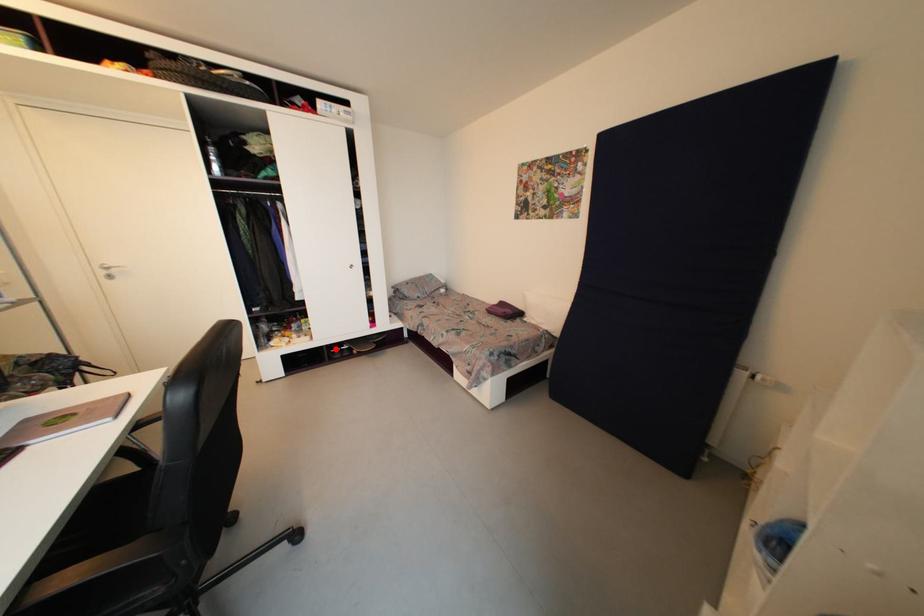
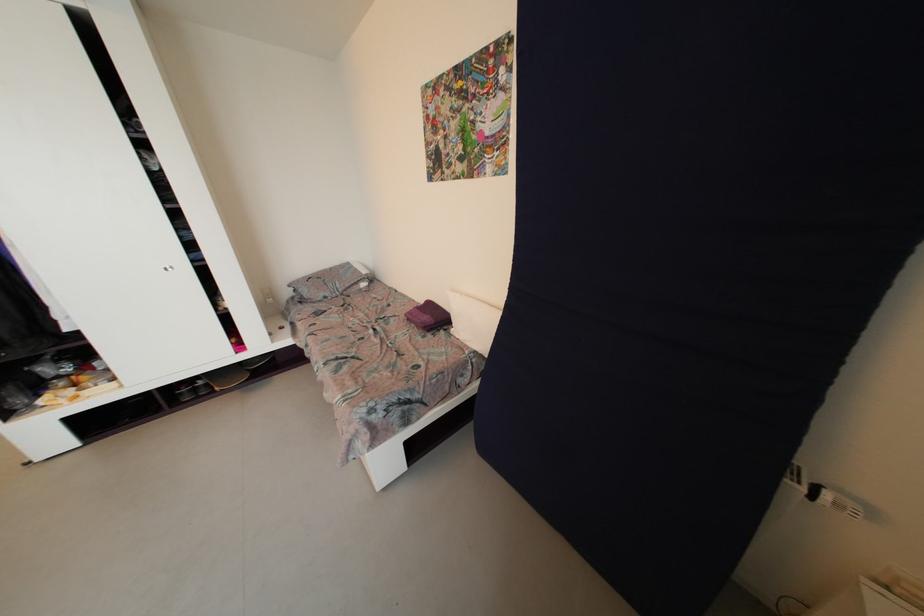
Locate, in the second image, the point that corresponds to the highlighted location in the first image.

(175, 391)